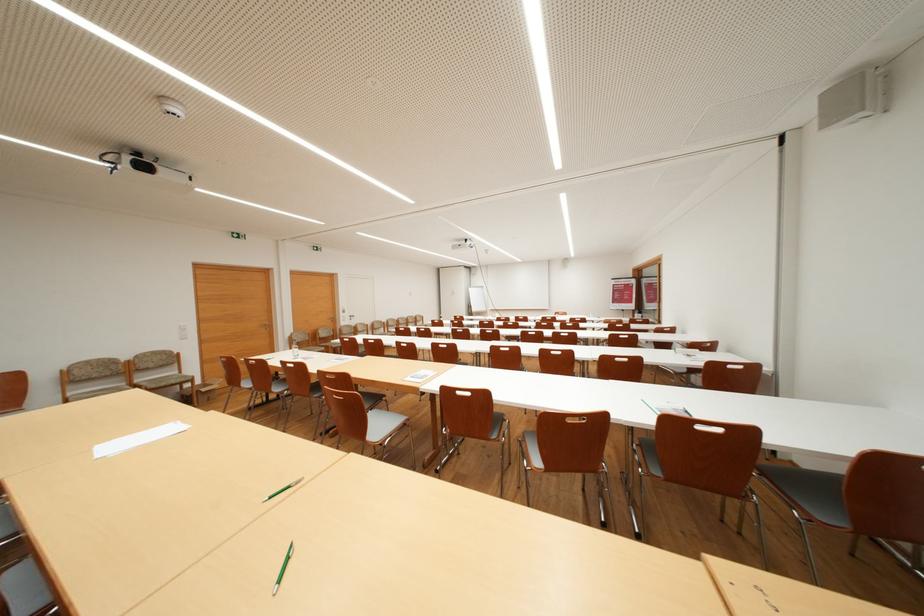
This screenshot has height=616, width=924. Identify the location of small water bottle. (295, 350).